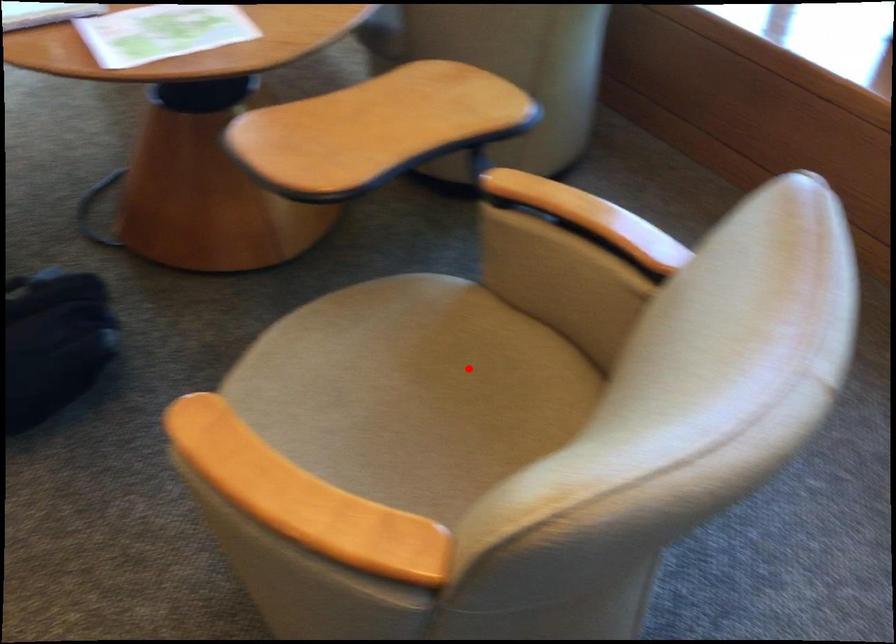
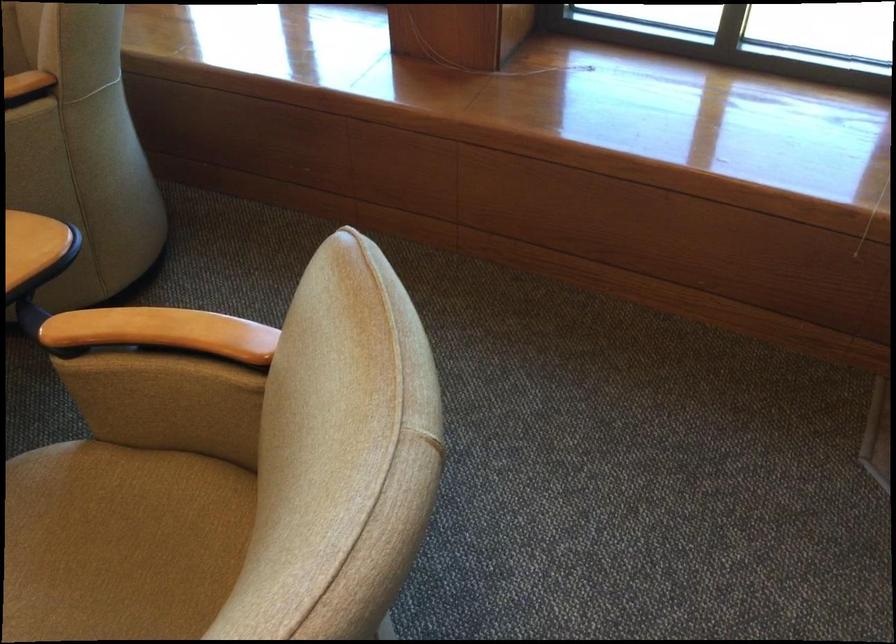
Question: I am providing you with two images of the same scene from different viewpoints. Given a red point in image1, look at the same physical point in image2. Is it:

Choices:
 (A) Closer to the viewpoint
 (B) Farther from the viewpoint

Answer: (A)